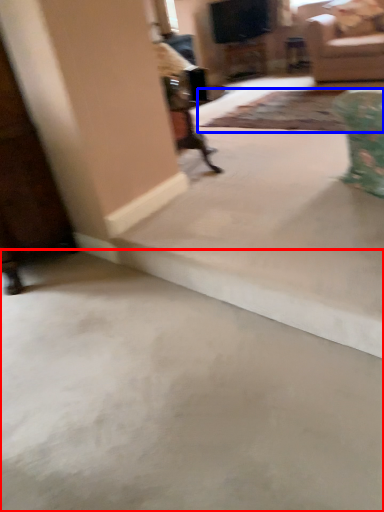
Question: Which point is closer to the camera, concrete (highlighted by a red box) or mat (highlighted by a blue box)?

Choices:
 (A) concrete
 (B) mat

Answer: (A)